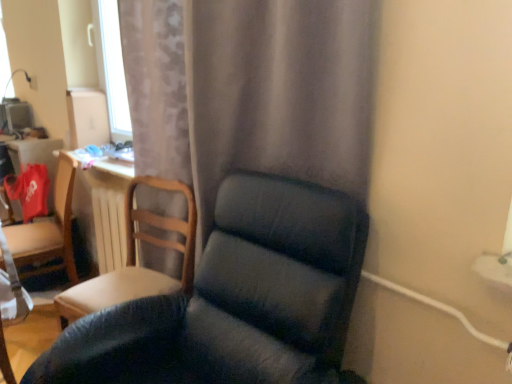
Question: Is point (79, 314) positioned closer to the camera than point (130, 29)?

Choices:
 (A) closer
 (B) farther

Answer: (A)

Question: Choose the correct answer: Is wooden chair at left, arranged as the second chair when viewed from the front, inside matte gray curtain at center or outside it?

Choices:
 (A) inside
 (B) outside

Answer: (B)

Question: Based on their relative distances, which object is farther from the wooden chair at left, arranged as the second chair when viewed from the front?

Choices:
 (A) white wooden radiator at center
 (B) dark blue fabric chair at center, which is the first chair from front to back
 (C) matte wooden chair at left, which appears as the first chair when viewed from the left
 (D) white plastic electric outlet at upper left
 (E) matte gray curtain at center

Answer: (D)

Question: Considering the real-world distances, which object is closest to the white wooden radiator at center?

Choices:
 (A) wooden chair at left, arranged as the second chair when viewed from the back
 (B) dark blue fabric chair at center, which is the first chair from front to back
 (C) white plastic electric outlet at upper left
 (D) matte gray curtain at center
 (E) matte wooden chair at left, positioned as the third chair in right-to-left order

Answer: (E)